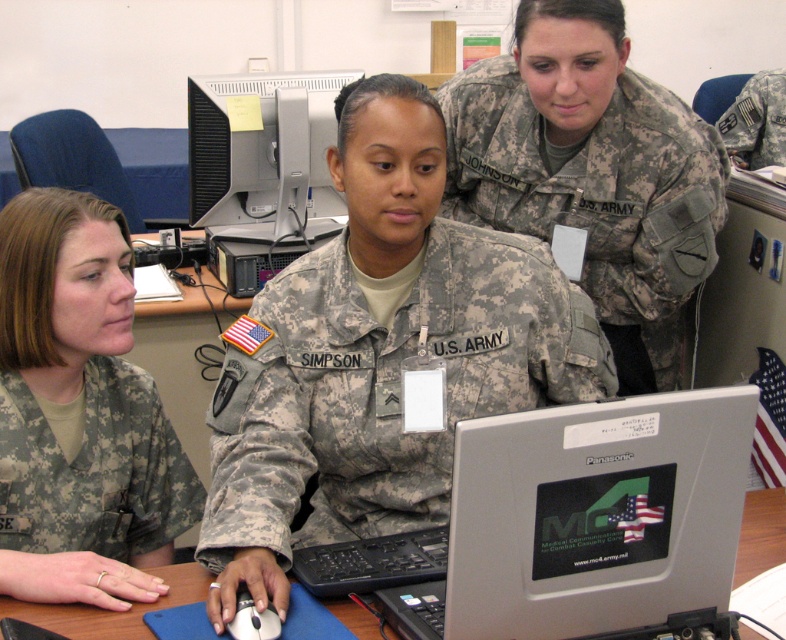
Who is more forward, (x=698, y=413) or (x=333, y=120)?

Point (x=698, y=413)

Which is more to the right, silver metallic laptop at center or matte gray monitor at center?

silver metallic laptop at center

Does point (520, 444) come in front of point (219, 179)?

Yes.

In order to click on silver metallic laptop at center in this screenshot , I will do `click(590, 522)`.

Based on the photo, is camouflage fabric us army uniform at center positioned in front of matte gray monitor at center?

That is True.

Who is positioned more to the right, camouflage fabric us army uniform at center or matte gray monitor at center?

camouflage fabric us army uniform at center

Between point (500, 333) and point (300, 128), which one is positioned behind?

Point (300, 128)

Identify the location of camouflage fabric us army uniform at center. Image resolution: width=786 pixels, height=640 pixels. (384, 387).

Describe the element at coordinates (384, 387) in the screenshot. The image size is (786, 640). I see `camouflage fabric us army uniform at center` at that location.

Based on the photo, between camouflage fabric us army uniform at center and black plastic mouse at lower center, which one has less height?

Standing shorter between the two is black plastic mouse at lower center.

Describe the element at coordinates (384, 387) in the screenshot. I see `camouflage fabric us army uniform at center` at that location.

Identify the location of camouflage fabric us army uniform at center. The height and width of the screenshot is (640, 786). (384, 387).